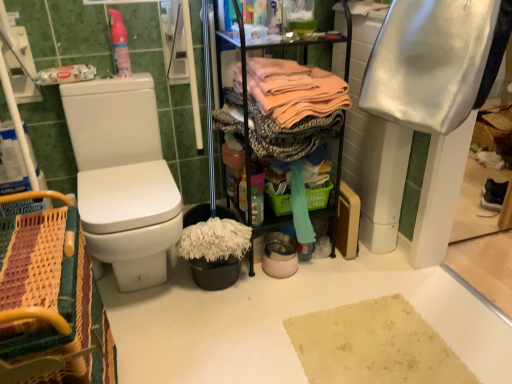
Question: Considering their positions, is woven wood picnic basket at lower left located in front of or behind black plastic bucket at lower center?

Choices:
 (A) behind
 (B) front

Answer: (B)

Question: Considering the positions of woven wood picnic basket at lower left and black plastic bucket at lower center in the image, is woven wood picnic basket at lower left taller or shorter than black plastic bucket at lower center?

Choices:
 (A) short
 (B) tall

Answer: (B)

Question: Which object is positioned farthest from the pink matte spray bottle at upper left?

Choices:
 (A) green plastic basket at center
 (B) white satin towel at upper right, which appears as the second clothing when viewed from the left
 (C) black plastic bucket at lower center
 (D) white matte toilet paper at left
 (E) woven wood picnic basket at lower left

Answer: (B)

Question: Estimate the real-world distances between objects in this image. Which object is farther from the white satin towel at upper right, which appears as the second clothing when viewed from the left?

Choices:
 (A) woven wood picnic basket at lower left
 (B) white matte toilet paper at left
 (C) pink matte spray bottle at upper left
 (D) white glossy toilet at left
 (E) pink fabric at center, marked as the second clothing in a right-to-left arrangement

Answer: (B)